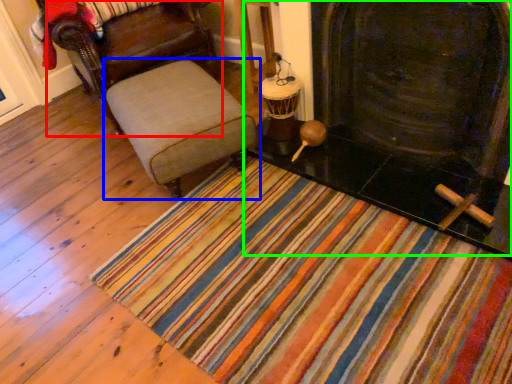
Question: Which object is positioned closest to chair (highlighted by a red box)? Select from furniture (highlighted by a blue box) and fireplace (highlighted by a green box).

Choices:
 (A) furniture
 (B) fireplace

Answer: (A)